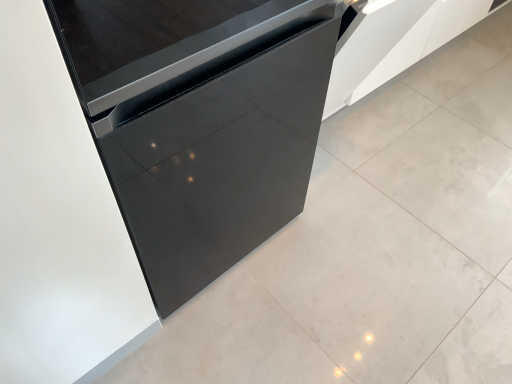
Question: Should I look upward or downward to see matte black dishwasher at center?

Choices:
 (A) down
 (B) up

Answer: (B)